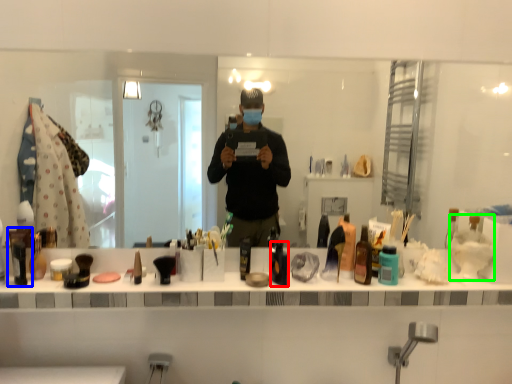
Question: Which object is positioned farthest from toiletry (highlighted by a red box)? Select from toiletry (highlighted by a blue box) and shaving cream (highlighted by a green box).

Choices:
 (A) toiletry
 (B) shaving cream

Answer: (A)